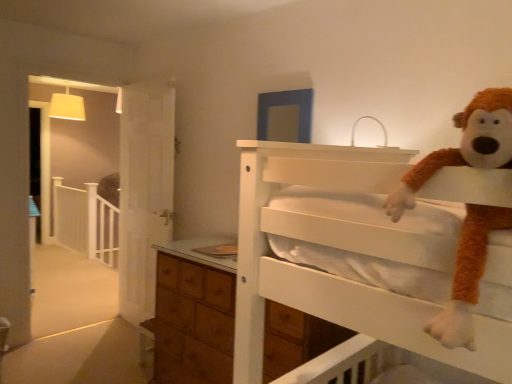
Question: Does white wooden balustrade at left appear on the right side of brown furry monkey at upper right?

Choices:
 (A) no
 (B) yes

Answer: (A)

Question: Is white wooden balustrade at left turned away from brown furry monkey at upper right?

Choices:
 (A) no
 (B) yes

Answer: (A)

Question: Considering the relative sizes of white wooden balustrade at left and brown furry monkey at upper right in the image provided, is white wooden balustrade at left shorter than brown furry monkey at upper right?

Choices:
 (A) no
 (B) yes

Answer: (A)

Question: Is white wooden balustrade at left taller than brown furry monkey at upper right?

Choices:
 (A) no
 (B) yes

Answer: (B)

Question: Is white wooden balustrade at left to the left of brown furry monkey at upper right from the viewer's perspective?

Choices:
 (A) no
 (B) yes

Answer: (B)

Question: From the image's perspective, is white wooden balustrade at left beneath brown furry monkey at upper right?

Choices:
 (A) no
 (B) yes

Answer: (B)

Question: Can we say brown furry monkey at upper right lies outside white wooden balustrade at left?

Choices:
 (A) yes
 (B) no

Answer: (A)

Question: Does brown furry monkey at upper right have a smaller size compared to white wooden balustrade at left?

Choices:
 (A) no
 (B) yes

Answer: (B)

Question: Is brown furry monkey at upper right taller than white wooden balustrade at left?

Choices:
 (A) no
 (B) yes

Answer: (A)

Question: Is brown furry monkey at upper right at the right side of white wooden balustrade at left?

Choices:
 (A) yes
 (B) no

Answer: (A)

Question: Is brown furry monkey at upper right oriented towards white wooden balustrade at left?

Choices:
 (A) no
 (B) yes

Answer: (A)

Question: From a real-world perspective, is brown furry monkey at upper right below white wooden balustrade at left?

Choices:
 (A) yes
 (B) no

Answer: (B)

Question: Which is correct: white wooden balustrade at left is inside brown furry monkey at upper right, or outside of it?

Choices:
 (A) outside
 (B) inside

Answer: (A)